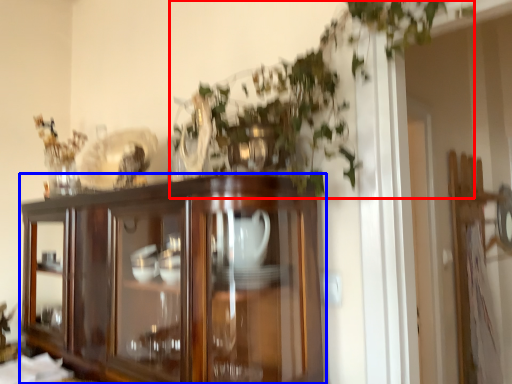
Question: Which of the following is the farthest to the observer, vegetation (highlighted by a red box) or cupboard (highlighted by a blue box)?

Choices:
 (A) vegetation
 (B) cupboard

Answer: (B)